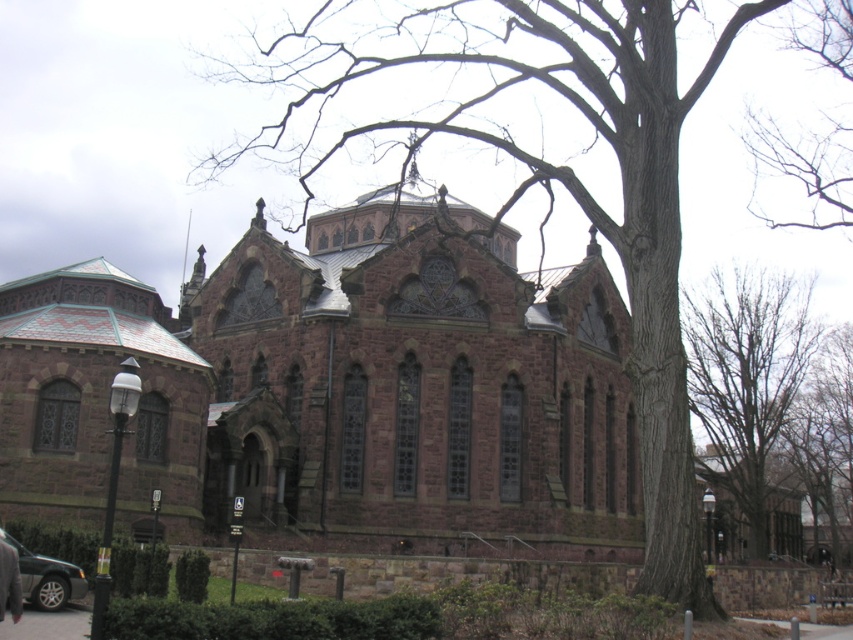
Question: Which point is closer to the camera?

Choices:
 (A) (810, 188)
 (B) (795, 372)
 (C) (364, 257)
 (D) (27, 563)

Answer: (D)

Question: Can you confirm if brown stone church at center is wider than bare branches at upper right?

Choices:
 (A) no
 (B) yes

Answer: (B)

Question: Based on their relative distances, which object is farther from the bare branches at upper center?

Choices:
 (A) bare branches at upper right
 (B) matte black sedan at lower left
 (C) brown stone church at center

Answer: (B)

Question: Does brown stone church at center come in front of matte black sedan at lower left?

Choices:
 (A) yes
 (B) no

Answer: (B)

Question: Based on their relative distances, which object is nearer to the brown stone church at center?

Choices:
 (A) matte black sedan at lower left
 (B) bare branches at upper right

Answer: (A)

Question: Observing the image, what is the correct spatial positioning of bare branches at upper right in reference to bare branches at upper center?

Choices:
 (A) left
 (B) right

Answer: (A)